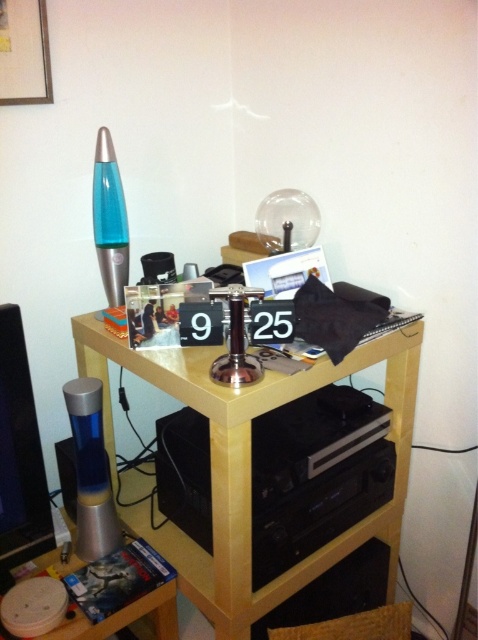
Which is behind, point (280, 502) or point (68, 618)?

Point (280, 502)

Is black plastic stereo at center wider than matte plastic dvd case at lower left?

Yes, black plastic stereo at center is wider than matte plastic dvd case at lower left.

In order to click on black plastic stereo at center in this screenshot , I will do `click(315, 474)`.

In the scene shown: Can you confirm if light wood table at center is positioned above black plastic stereo at center?

Yes.

Can you confirm if light wood table at center is shorter than black plastic stereo at center?

In fact, light wood table at center may be taller than black plastic stereo at center.

This screenshot has width=478, height=640. What do you see at coordinates (249, 464) in the screenshot?
I see `light wood table at center` at bounding box center [249, 464].

The height and width of the screenshot is (640, 478). Find the location of `light wood table at center`. light wood table at center is located at coordinates (249, 464).

The width and height of the screenshot is (478, 640). What do you see at coordinates (249, 464) in the screenshot?
I see `light wood table at center` at bounding box center [249, 464].

Can you confirm if light wood table at center is positioned to the right of matte plastic dvd case at lower left?

Correct, you'll find light wood table at center to the right of matte plastic dvd case at lower left.

Where is `light wood table at center`? light wood table at center is located at coordinates (249, 464).